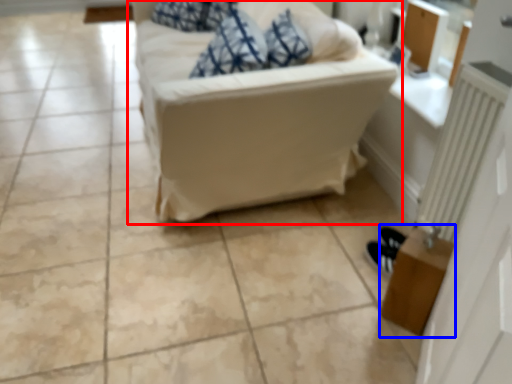
Question: Which of the following is the closest to the observer, studio couch (highlighted by a red box) or table (highlighted by a blue box)?

Choices:
 (A) studio couch
 (B) table

Answer: (B)